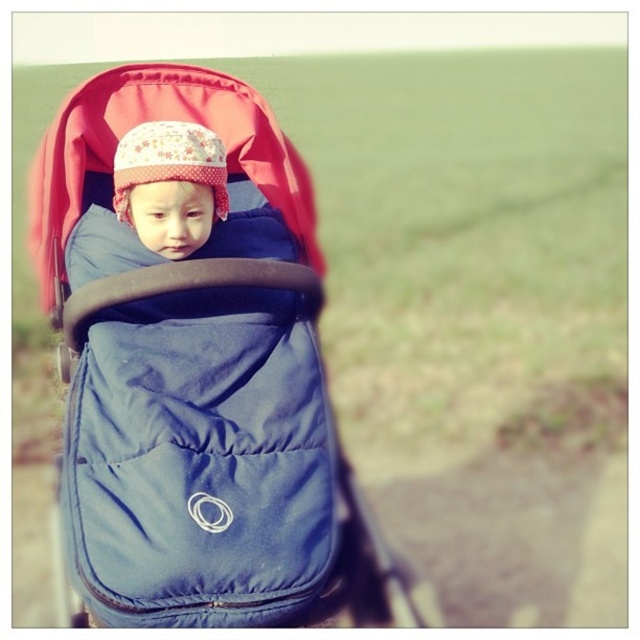
Image resolution: width=640 pixels, height=640 pixels. What do you see at coordinates (196, 374) in the screenshot? I see `blue fabric baby carriage at center` at bounding box center [196, 374].

Can you confirm if blue fabric baby carriage at center is bigger than fluffy fabric hat at center?

Yes.

Between point (218, 374) and point (124, 220), which one is positioned in front?

Point (218, 374) is in front.

You are a GUI agent. You are given a task and a screenshot of the screen. Output one action in this format:
    pyautogui.click(x=<x>, y=<y>)
    Task: Click on the blue fabric baby carriage at center
    
    Given the screenshot: What is the action you would take?
    pyautogui.click(x=196, y=374)